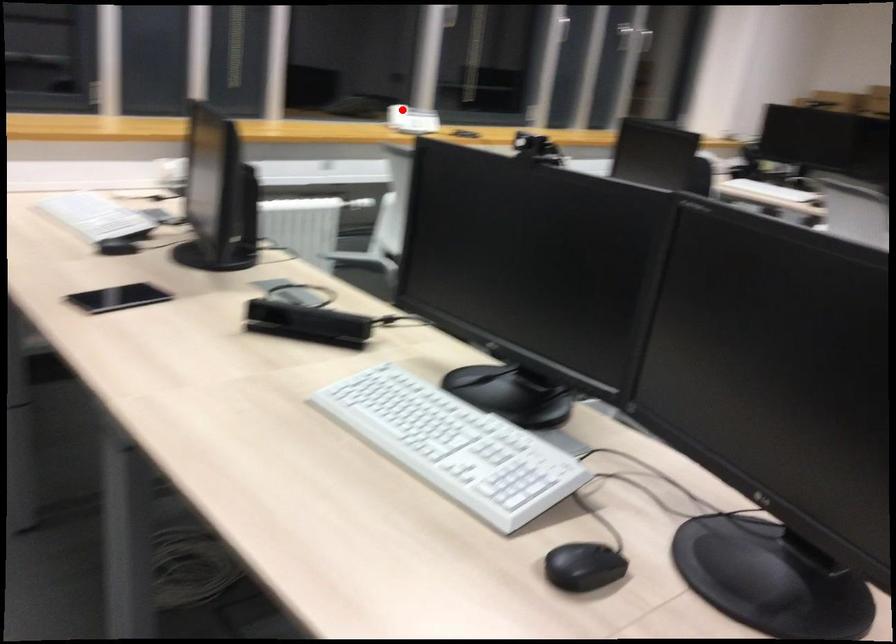
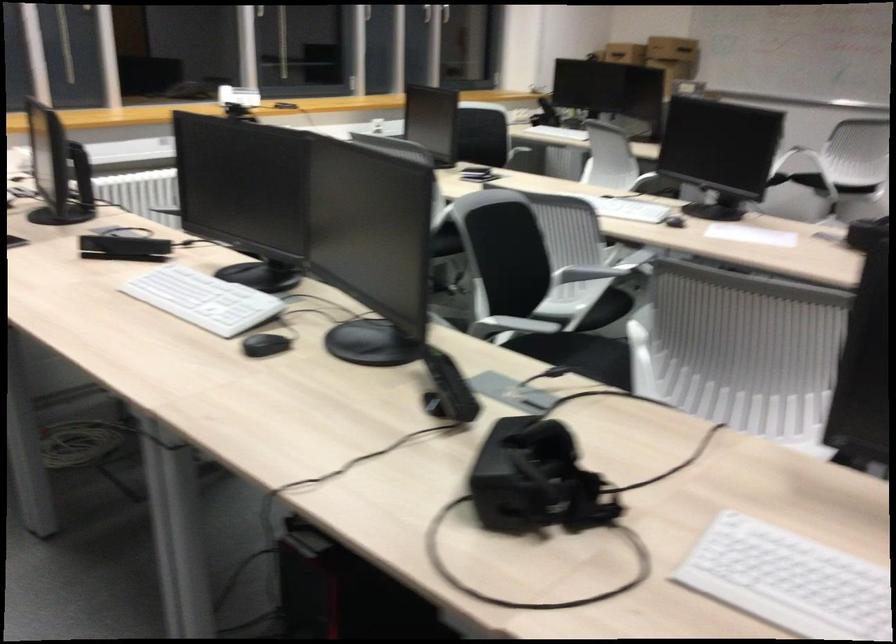
In the second image, find the point that corresponds to the highlighted location in the first image.

(238, 96)